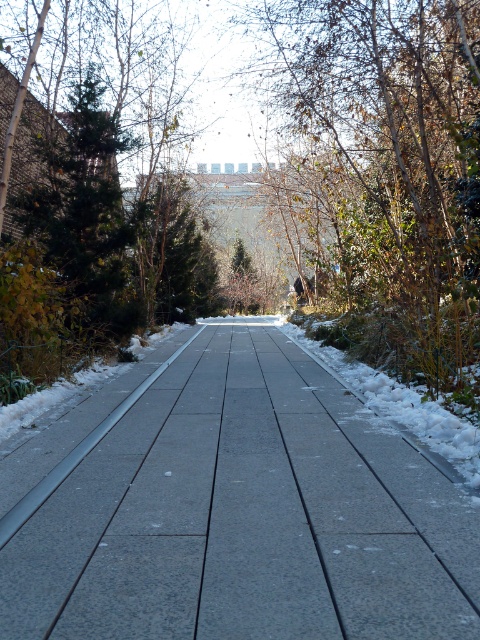
Question: Can you confirm if gray concrete pavement at center is thinner than brown leafy tree at center?

Choices:
 (A) yes
 (B) no

Answer: (A)

Question: Can you confirm if gray concrete pavement at center is bigger than brown leafy tree at center?

Choices:
 (A) no
 (B) yes

Answer: (A)

Question: Can you confirm if gray concrete pavement at center is wider than brown leafy tree at center?

Choices:
 (A) no
 (B) yes

Answer: (A)